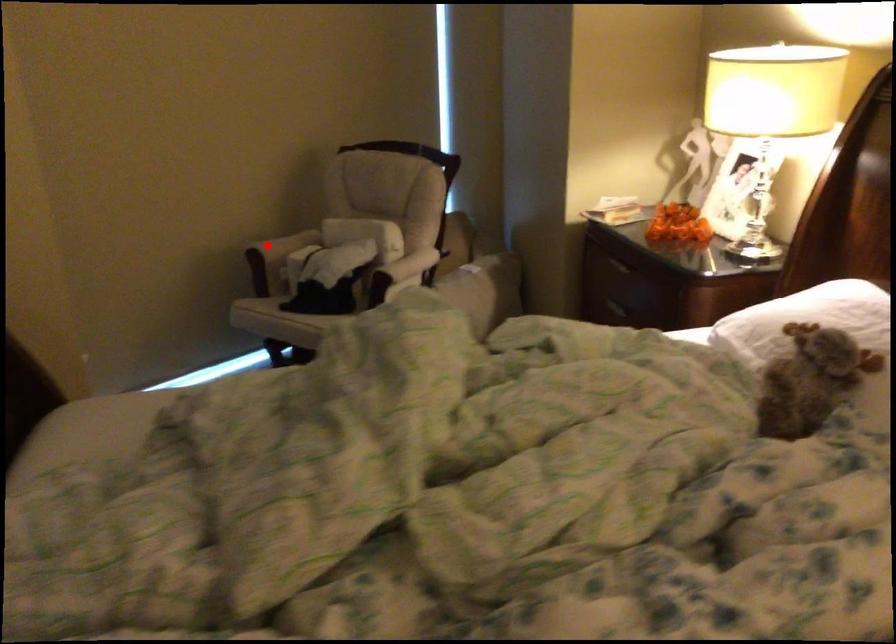
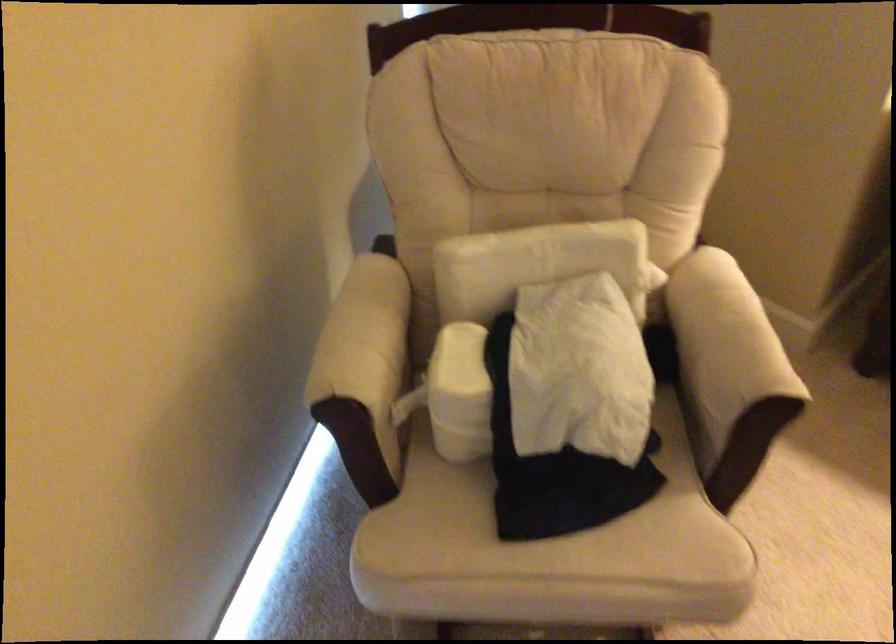
Question: I am providing you with two images of the same scene from different viewpoints. Given a red point in image1, look at the same physical point in image2. Is it:

Choices:
 (A) Closer to the viewpoint
 (B) Farther from the viewpoint

Answer: (A)